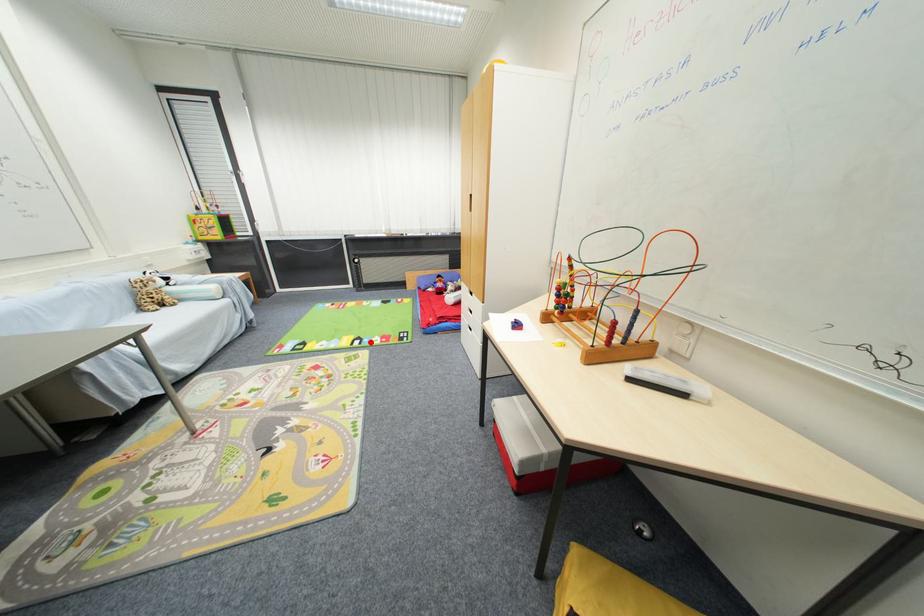
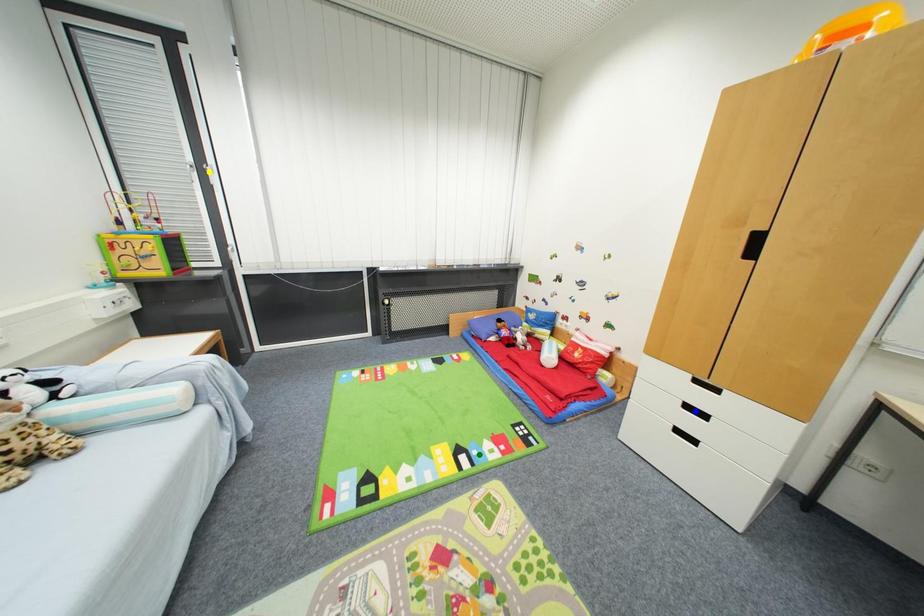
Question: I am providing you with two images of the same scene from different viewpoints. A red point is marked on the first image. You are given multiple points on the second image. Which point in image 2 is actually the same real-world point as the red point in image 1?

Choices:
 (A) yellow point
 (B) green point
 (C) blue point

Answer: (B)